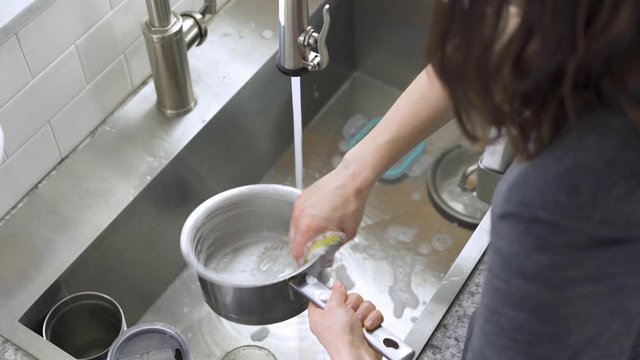
Find the suds in the sink on the lower middle of it in the image. Your answer should be formatted as a list of tuples, i.e. [(x1, y1), (x2, y2), ...], where each tuple contains the x and y coordinates of a point satisfying the conditions above.

[(409, 298)]